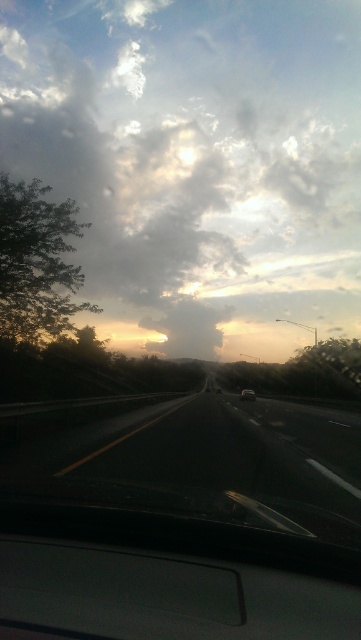
You are driving a car and notice the cloudy sky at upper center and the shiny silver sedan at center ahead. Which object is located higher in the scene?

The cloudy sky at upper center is positioned over the shiny silver sedan at center, so it is higher in the scene.

You are a passenger in the vehicle and looking out the window. You notice the cloudy sky at upper center and the shiny silver sedan at center. Which object takes up more horizontal space in the scene?

The cloudy sky at upper center takes up more horizontal space than the shiny silver sedan at center because its width surpasses the sedan.

You are a passenger in the car and looking out the window. You see the cloudy sky at upper center and the black asphalt highway at center. Which object is taller from your viewpoint?

The cloudy sky at upper center is much taller than the black asphalt highway at center.